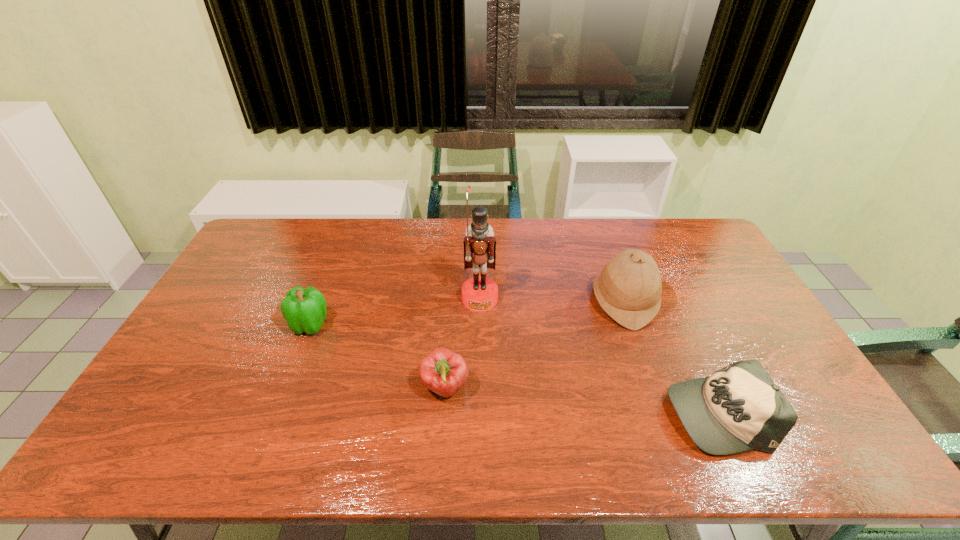
I want to click on vacant space at the near edge of the desktop, so click(x=232, y=437).

Where is `free space at the left edge`? Image resolution: width=960 pixels, height=540 pixels. free space at the left edge is located at coordinates (225, 368).

Where is `free point at the right edge`? Image resolution: width=960 pixels, height=540 pixels. free point at the right edge is located at coordinates (727, 275).

At what (x,y) coordinates should I click in order to perform the action: click on free space at the far left corner of the desktop. Please return your answer as a coordinate pair (x, y). Image resolution: width=960 pixels, height=540 pixels. Looking at the image, I should click on (295, 230).

I want to click on free space between the shorter bell pepper and the farther bell pepper, so click(378, 356).

Find the location of a particular element. free space between the baseball cap and the nearer bell pepper is located at coordinates [x=581, y=400].

Where is `free spot between the hat and the baseball cap`? The height and width of the screenshot is (540, 960). free spot between the hat and the baseball cap is located at coordinates (670, 357).

The image size is (960, 540). What are the coordinates of `vacant region between the second tallest object and the nutcracker` in the screenshot? It's located at (552, 300).

This screenshot has width=960, height=540. I want to click on empty space between the tallest object and the nearer bell pepper, so click(x=463, y=343).

This screenshot has height=540, width=960. Identify the location of vacant space that's between the nutcracker and the shorter bell pepper. (463, 343).